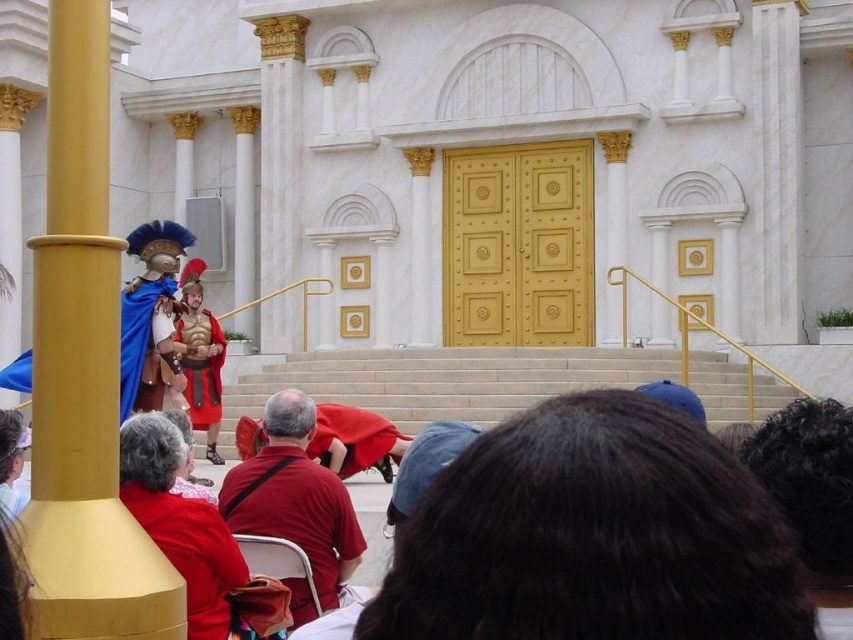
Which of these two, gold polished pole at left or red fabric cape at center, stands shorter?

With less height is red fabric cape at center.

Does point (44, 602) come closer to viewer compared to point (282, 420)?

That is True.

Is point (78, 424) positioned before point (322, 588)?

Yes, point (78, 424) is closer to viewer.

This screenshot has height=640, width=853. What are the coordinates of `gold polished pole at left` in the screenshot? It's located at (84, 371).

Does gold polished pole at left appear under blue velvet cape at center?

No, gold polished pole at left is not below blue velvet cape at center.

Does point (105, 38) come closer to viewer compared to point (126, 369)?

Yes, point (105, 38) is closer to viewer.

Image resolution: width=853 pixels, height=640 pixels. What do you see at coordinates (84, 371) in the screenshot?
I see `gold polished pole at left` at bounding box center [84, 371].

This screenshot has height=640, width=853. Identify the location of gold polished pole at left. (84, 371).

The height and width of the screenshot is (640, 853). What do you see at coordinates (354, 440) in the screenshot?
I see `red velvet cape at center` at bounding box center [354, 440].

Which of these two, red velvet cape at center or shiny gold armor at center, stands taller?

shiny gold armor at center

This screenshot has height=640, width=853. Describe the element at coordinates (354, 440) in the screenshot. I see `red velvet cape at center` at that location.

The height and width of the screenshot is (640, 853). I want to click on red velvet cape at center, so click(354, 440).